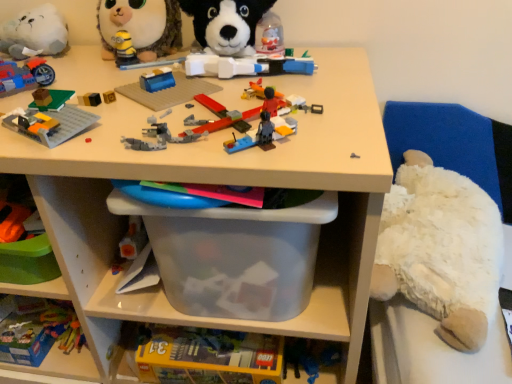
This screenshot has width=512, height=384. I want to click on vacant area that is in front of white plush dog at upper center, which is the 2th toy from right to left, so click(x=248, y=87).